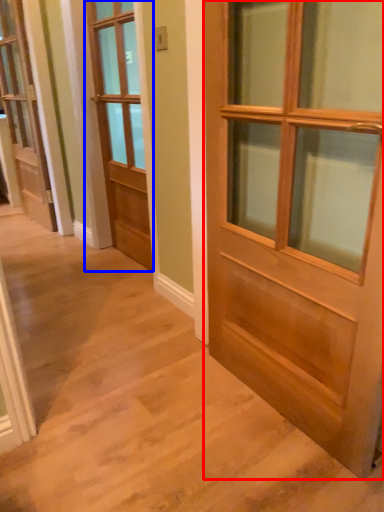
Question: Which of the following is the closest to the observer, door (highlighted by a red box) or door (highlighted by a blue box)?

Choices:
 (A) door
 (B) door

Answer: (A)